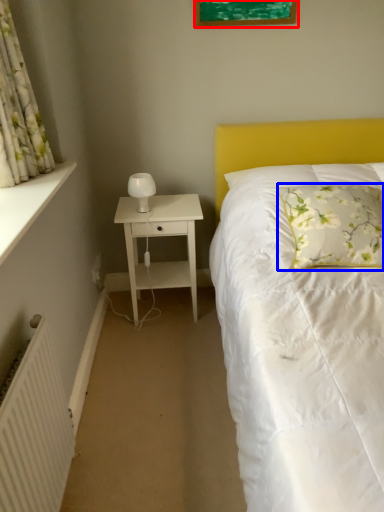
Question: Which object is closer to the camera taking this photo, picture frame (highlighted by a red box) or pillow (highlighted by a blue box)?

Choices:
 (A) picture frame
 (B) pillow

Answer: (B)